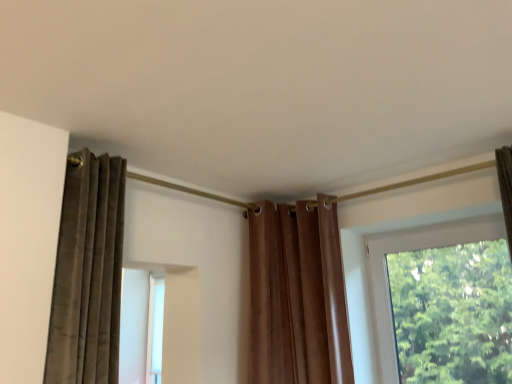
Question: In terms of width, does brown velvet curtain at center look wider or thinner when compared to transparent glass window at right?

Choices:
 (A) thin
 (B) wide

Answer: (B)

Question: Is point (337, 362) closer or farther from the camera than point (424, 235)?

Choices:
 (A) farther
 (B) closer

Answer: (B)

Question: In the image, is brown velvet curtain at center positioned in front of or behind transparent glass window at right?

Choices:
 (A) front
 (B) behind

Answer: (B)

Question: Is point (384, 327) positioned closer to the camera than point (335, 352)?

Choices:
 (A) closer
 (B) farther

Answer: (B)

Question: Is transparent glass window at right situated inside brown velvet curtain at center or outside?

Choices:
 (A) inside
 (B) outside

Answer: (B)

Question: Would you say transparent glass window at right is to the left or to the right of brown velvet curtain at center in the picture?

Choices:
 (A) right
 (B) left

Answer: (A)

Question: Considering the positions of transparent glass window at right and brown velvet curtain at center in the image, is transparent glass window at right taller or shorter than brown velvet curtain at center?

Choices:
 (A) tall
 (B) short

Answer: (B)